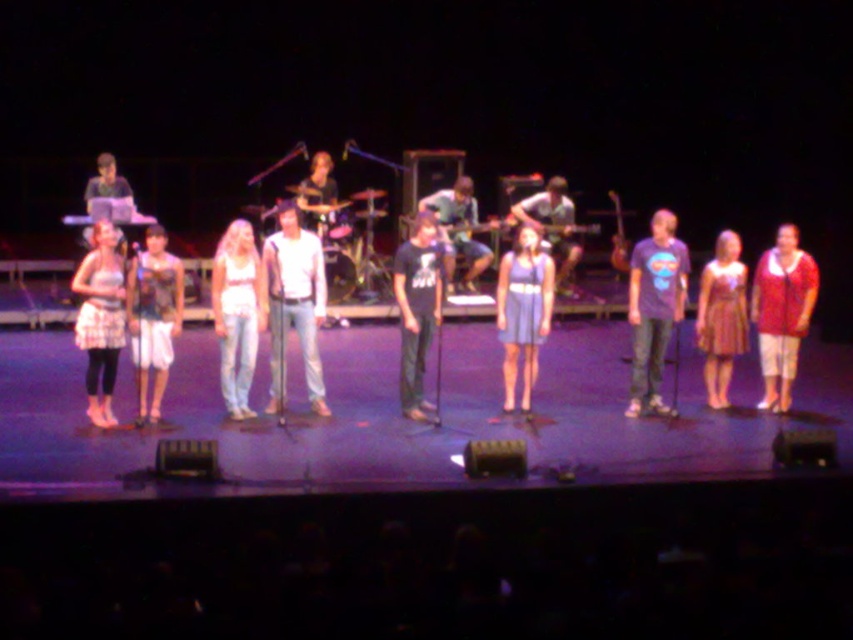
You are a photographer positioned at the back of the theater, and you want to capture a photo of the matte black tank top at left and the shiny purple dress at right. Which performer should you focus on first if you want to start with the one closer to the front?

The matte black tank top at left is to the left of the shiny purple dress at right, so the photographer should focus on the matte black tank top at left first since it is positioned closer to the front.